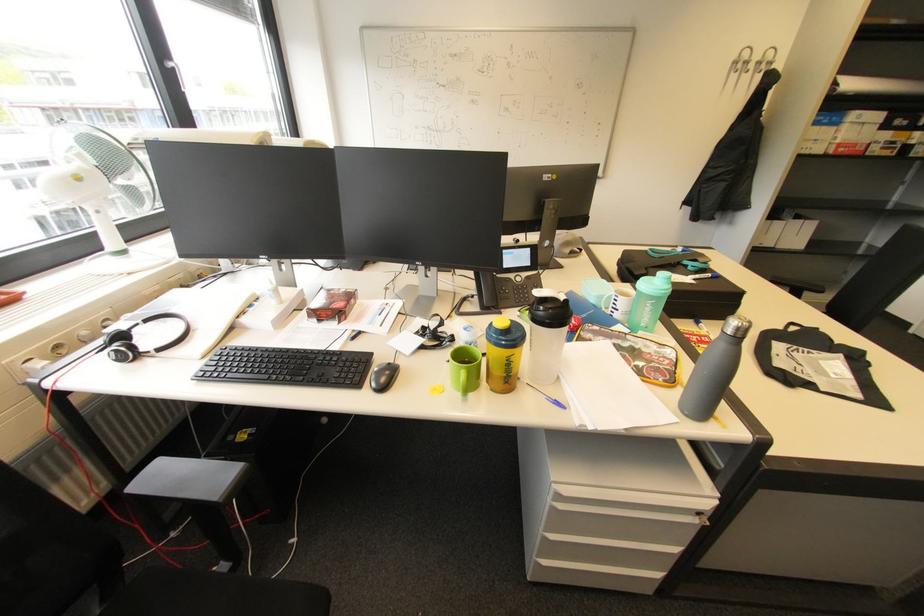
Identify the location of grey bottle cap. Image resolution: width=924 pixels, height=616 pixels. (736, 326).